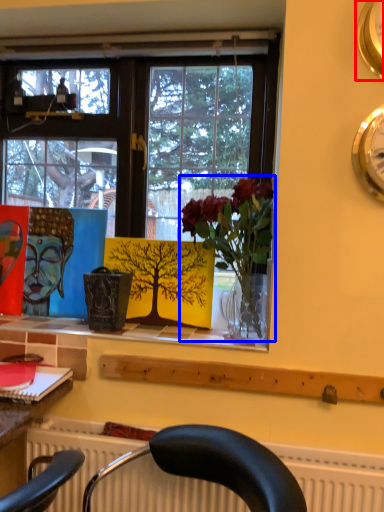
Question: Which of the following is the farthest to the observer, clock (highlighted by a red box) or houseplant (highlighted by a blue box)?

Choices:
 (A) clock
 (B) houseplant

Answer: (B)